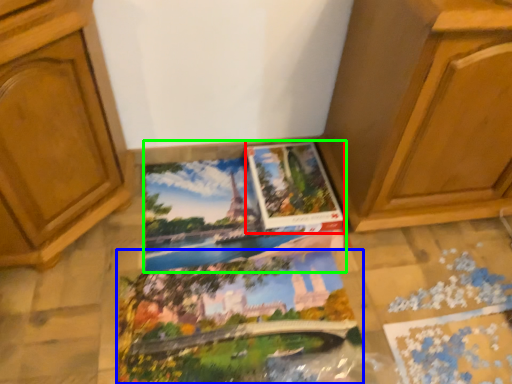
Question: Which object is the farthest from album (highlighted by a red box)? Choose among these: coloring book (highlighted by a blue box) or coloring book (highlighted by a green box).

Choices:
 (A) coloring book
 (B) coloring book

Answer: (A)